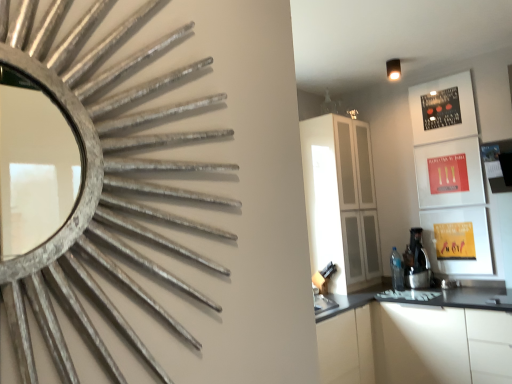
Question: Could white glossy cabinetry at lower right, the second cabinetry from the top, be considered to be inside white glossy cabinet at center, which is the first cabinetry in top-to-bottom order?

Choices:
 (A) no
 (B) yes

Answer: (A)

Question: Considering the relative sizes of white glossy cabinet at center, which is the first cabinetry in top-to-bottom order, and white glossy cabinetry at lower right, the first cabinetry positioned from the bottom, in the image provided, is white glossy cabinet at center, which is the first cabinetry in top-to-bottom order, taller than white glossy cabinetry at lower right, the first cabinetry positioned from the bottom,?

Choices:
 (A) yes
 (B) no

Answer: (A)

Question: From the image's perspective, is white glossy cabinet at center, which is the first cabinetry in top-to-bottom order, above white glossy cabinetry at lower right, the first cabinetry positioned from the bottom?

Choices:
 (A) no
 (B) yes

Answer: (B)

Question: Is white glossy cabinet at center, which is the first cabinetry in top-to-bottom order, aimed at white glossy cabinetry at lower right, the second cabinetry from the top?

Choices:
 (A) yes
 (B) no

Answer: (B)

Question: Is the depth of white glossy cabinet at center, the second cabinetry in the bottom-to-top sequence, less than that of white glossy cabinetry at lower right, the second cabinetry from the top?

Choices:
 (A) no
 (B) yes

Answer: (A)

Question: Can you confirm if white glossy cabinet at center, the second cabinetry in the bottom-to-top sequence, is wider than white glossy cabinetry at lower right, the second cabinetry from the top?

Choices:
 (A) no
 (B) yes

Answer: (A)

Question: Is white glossy cabinetry at lower right, the second cabinetry from the top, next to white glossy cabinet at center, which is the first cabinetry in top-to-bottom order, and touching it?

Choices:
 (A) no
 (B) yes

Answer: (A)

Question: Is white glossy cabinetry at lower right, the second cabinetry from the top, oriented towards white glossy cabinet at center, the second cabinetry in the bottom-to-top sequence?

Choices:
 (A) yes
 (B) no

Answer: (B)

Question: From a real-world perspective, is white glossy cabinetry at lower right, the second cabinetry from the top, positioned over white glossy cabinet at center, which is the first cabinetry in top-to-bottom order, based on gravity?

Choices:
 (A) no
 (B) yes

Answer: (A)

Question: From the image's perspective, is white glossy cabinetry at lower right, the second cabinetry from the top, below white glossy cabinet at center, the second cabinetry in the bottom-to-top sequence?

Choices:
 (A) no
 (B) yes

Answer: (B)

Question: Considering the relative sizes of white glossy cabinetry at lower right, the first cabinetry positioned from the bottom, and white glossy cabinet at center, which is the first cabinetry in top-to-bottom order, in the image provided, is white glossy cabinetry at lower right, the first cabinetry positioned from the bottom, shorter than white glossy cabinet at center, which is the first cabinetry in top-to-bottom order,?

Choices:
 (A) no
 (B) yes

Answer: (B)

Question: Is white glossy cabinetry at lower right, the first cabinetry positioned from the bottom, not close to white glossy cabinet at center, which is the first cabinetry in top-to-bottom order?

Choices:
 (A) no
 (B) yes

Answer: (A)

Question: From a real-world perspective, is white glossy cabinetry at lower right, the second cabinetry from the top, positioned under satin black coffee machine at right based on gravity?

Choices:
 (A) yes
 (B) no

Answer: (A)